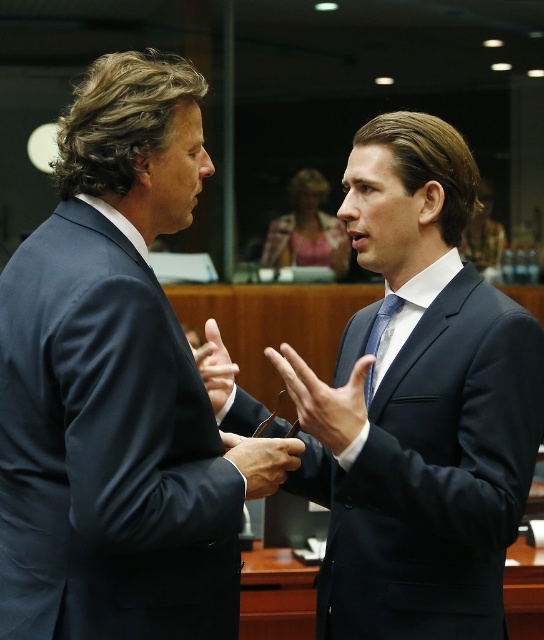
Can you confirm if smooth black suit at center is bigger than black leather hand at center?

Correct, smooth black suit at center is larger in size than black leather hand at center.

Is point (298, 406) farther from camera compared to point (296, 452)?

Yes, it is.

The image size is (544, 640). I want to click on smooth black suit at center, so click(x=324, y=397).

Identify the location of smooth black suit at center. Image resolution: width=544 pixels, height=640 pixels. (324, 397).

Does black leather hand at center appear over matte blue tie at center?

Incorrect, black leather hand at center is not positioned above matte blue tie at center.

Is point (256, 490) positioned behind point (379, 336)?

That is False.

Is point (244, 468) positioned behind point (384, 310)?

No, (244, 468) is in front of (384, 310).

At what (x,y) coordinates should I click in order to perform the action: click on black leather hand at center. Please return your answer as a coordinate pair (x, y). The image size is (544, 640). Looking at the image, I should click on (262, 460).

Who is more forward, (180,513) or (304,388)?

Point (180,513)

Is matte black suit at left below smooth black suit at center?

No, matte black suit at left is not below smooth black suit at center.

Does point (234, 561) lie behind point (307, 368)?

No, it is not.

This screenshot has width=544, height=640. I want to click on matte black suit at left, so [x=113, y=385].